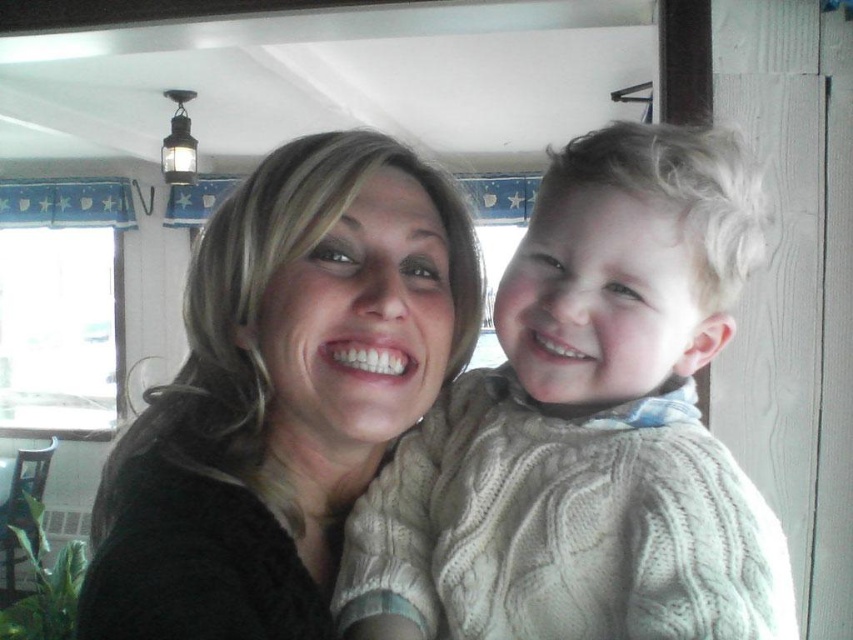
Who is lower down, creamy knit sweater at center or matte black sweater at center?

creamy knit sweater at center is lower down.

Is creamy knit sweater at center below matte black sweater at center?

Indeed, creamy knit sweater at center is positioned under matte black sweater at center.

Describe the element at coordinates (589, 426) in the screenshot. This screenshot has width=853, height=640. I see `creamy knit sweater at center` at that location.

I want to click on creamy knit sweater at center, so click(x=589, y=426).